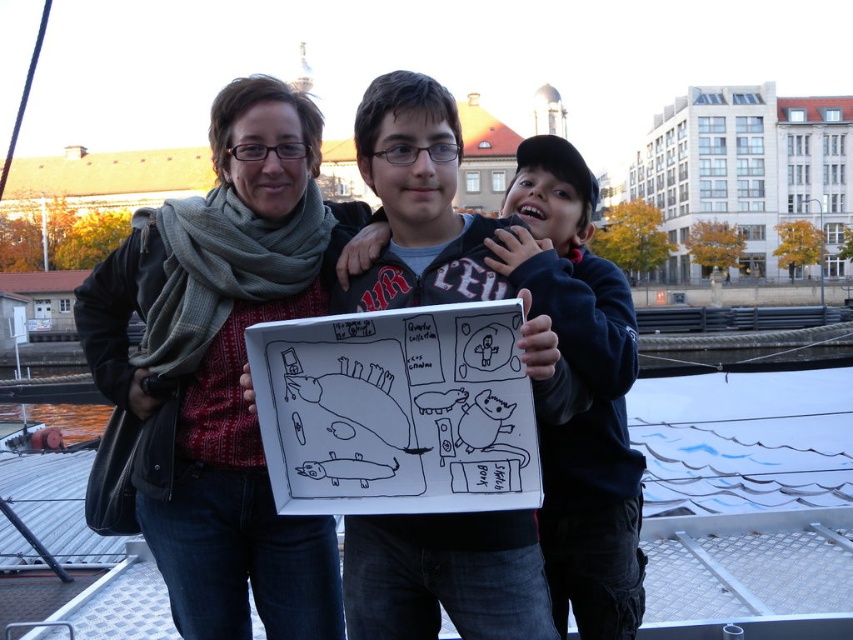
Describe the element at coordinates (219, 371) in the screenshot. I see `knitted scarf at center` at that location.

Does knitted scarf at center have a greater height compared to matte black jacket at center?

Indeed, knitted scarf at center has a greater height compared to matte black jacket at center.

Between point (129, 448) and point (556, 205), which one is positioned behind?

Positioned behind is point (556, 205).

I want to click on knitted scarf at center, so click(x=219, y=371).